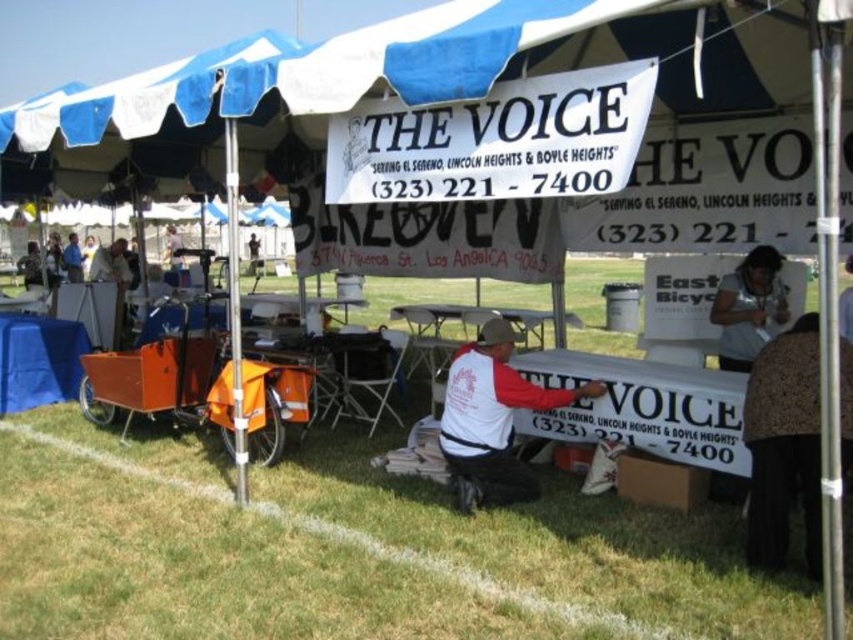
You are at an event under a large canopy tent labeled THE VOICE with a phone number. You see a metallic silver folding table at center and a light blue shirt at center. Which object is positioned to the right of the other?

The metallic silver folding table at center is to the right of the light blue shirt at center.

You are standing at the entrance of the canopy tent and want to find the metallic silver folding table at center. According to the coordinates provided, in which direction should you walk from the entrance to reach it?

The metallic silver folding table at center is located at coordinates point (465,320), meaning it is positioned towards the center of the tent. Since you are at the entrance, you should walk straight ahead towards the center of the tent to reach it.